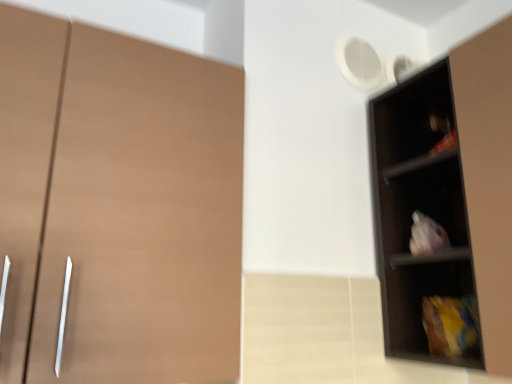
Question: Based on their positions, is matte brown cupboard at left located to the left or right of black matte shelf at right?

Choices:
 (A) left
 (B) right

Answer: (A)

Question: Is matte brown cupboard at left bigger or smaller than black matte shelf at right?

Choices:
 (A) big
 (B) small

Answer: (A)

Question: From the image's perspective, is matte brown cupboard at left above or below black matte shelf at right?

Choices:
 (A) below
 (B) above

Answer: (B)

Question: Is point (454, 281) closer or farther from the camera than point (49, 36)?

Choices:
 (A) closer
 (B) farther

Answer: (B)

Question: From their relative heights in the image, would you say black matte shelf at right is taller or shorter than matte brown cupboard at left?

Choices:
 (A) short
 (B) tall

Answer: (B)

Question: From a real-world perspective, is black matte shelf at right positioned above or below matte brown cupboard at left?

Choices:
 (A) below
 (B) above

Answer: (B)

Question: Is black matte shelf at right situated inside matte brown cupboard at left or outside?

Choices:
 (A) outside
 (B) inside

Answer: (A)